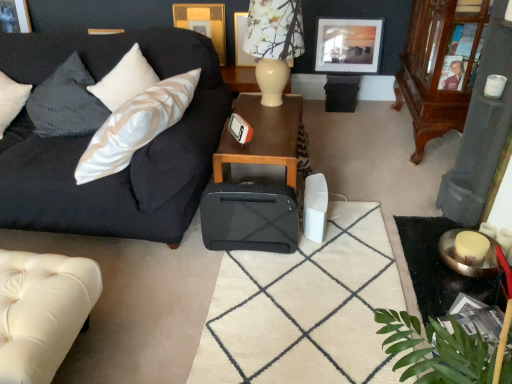
I want to click on free location above wooden table at center (from a real-world perspective), so click(264, 115).